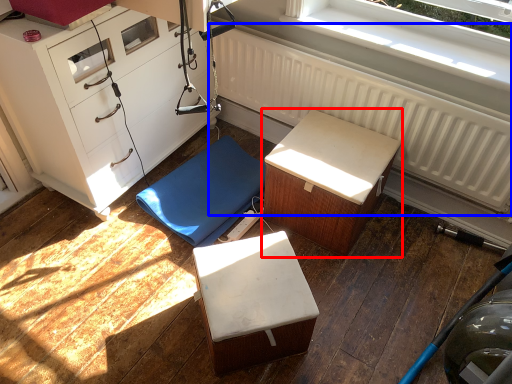
Question: Among these objects, which one is farthest to the camera, furniture (highlighted by a red box) or radiator (highlighted by a blue box)?

Choices:
 (A) furniture
 (B) radiator

Answer: (A)